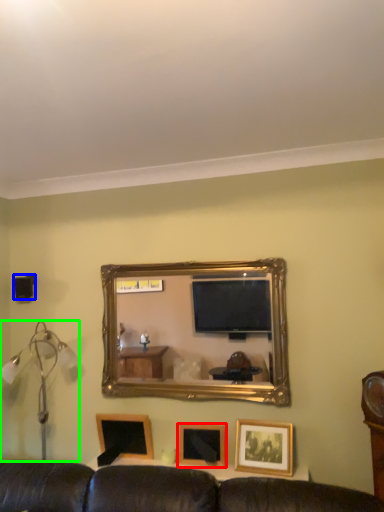
Question: Based on their relative distances, which object is farther from picture frame (highlighted by a red box)? Choose from speaker (highlighted by a blue box) and table lamp (highlighted by a green box).

Choices:
 (A) speaker
 (B) table lamp

Answer: (A)